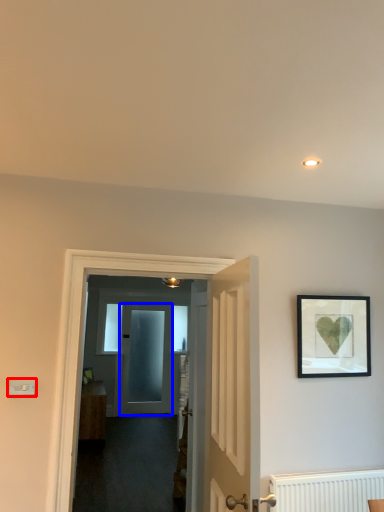
Question: Which object is closer to the camera taking this photo, light switch (highlighted by a red box) or door (highlighted by a blue box)?

Choices:
 (A) light switch
 (B) door

Answer: (A)